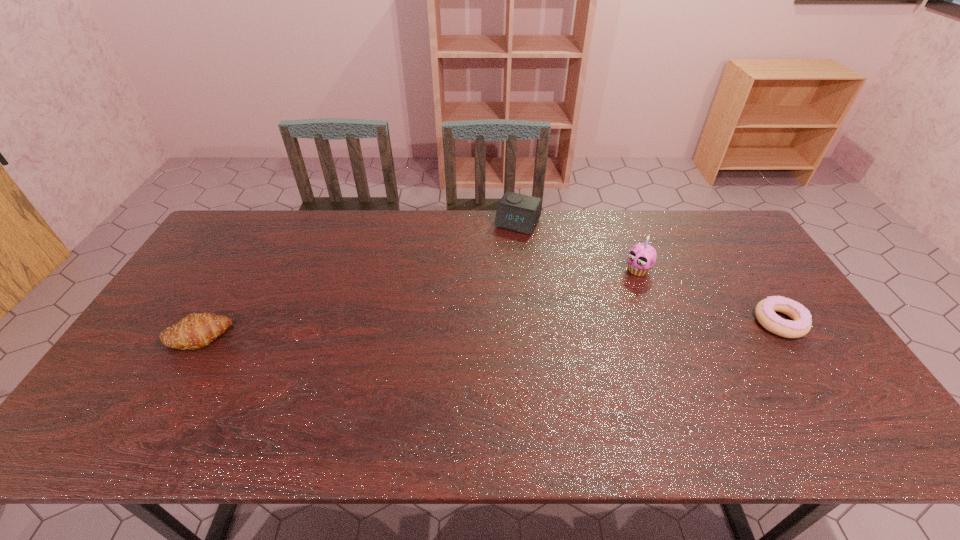
Where is `free space on the desktop that is between the leftmost object and the rightmost object and is positioned on the face of the tallest object`? This screenshot has height=540, width=960. free space on the desktop that is between the leftmost object and the rightmost object and is positioned on the face of the tallest object is located at coordinates (568, 327).

Identify the location of free space on the desktop that is between the crescent roll and the doughnut and is positioned on the front-facing side of the farthest object. The image size is (960, 540). (459, 330).